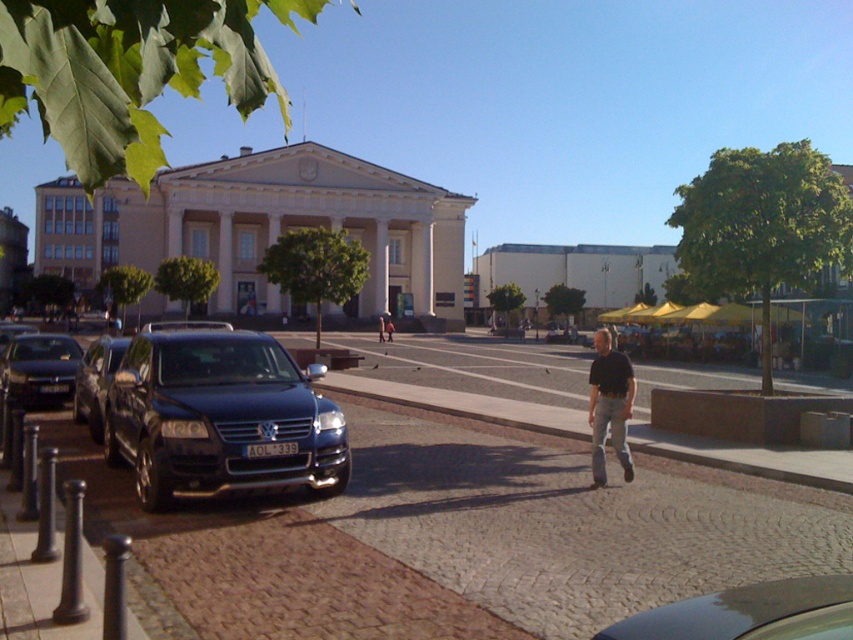
Looking at this image, which is above, shiny black car at center or shiny black suv at left?

shiny black suv at left

Is point (753, 588) farther from camera compared to point (82, 394)?

No, it is not.

What do you see at coordinates (735, 611) in the screenshot?
I see `shiny black car at center` at bounding box center [735, 611].

I want to click on shiny black car at center, so click(x=735, y=611).

Between matte black car at left and dark blue jeans at center, which one appears on the left side from the viewer's perspective?

Positioned to the left is matte black car at left.

Does matte black car at left come behind dark blue jeans at center?

No.

At what (x,y) coordinates should I click in order to perform the action: click on matte black car at left. Please return your answer as a coordinate pair (x, y). The width and height of the screenshot is (853, 640). Looking at the image, I should click on coord(39,369).

Where is `matte black car at left`? Image resolution: width=853 pixels, height=640 pixels. matte black car at left is located at coordinates (39, 369).

Between cobblestone pavement at center and shiny black suv at left, which one appears on the left side from the viewer's perspective?

shiny black suv at left

Does cobblestone pavement at center have a greater width compared to shiny black suv at left?

Yes, cobblestone pavement at center is wider than shiny black suv at left.

Which is behind, point (347, 554) or point (112, 365)?

The point (112, 365) is more distant.

At what (x,y) coordinates should I click in order to perform the action: click on cobblestone pavement at center. Please return your answer as a coordinate pair (x, y). Looking at the image, I should click on (451, 538).